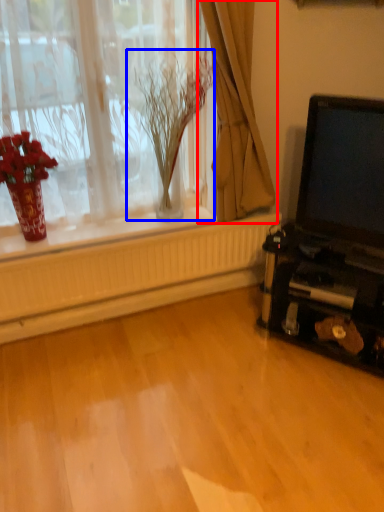
Question: Which object appears farthest to the camera in this image, curtain (highlighted by a red box) or plant (highlighted by a blue box)?

Choices:
 (A) curtain
 (B) plant

Answer: (B)